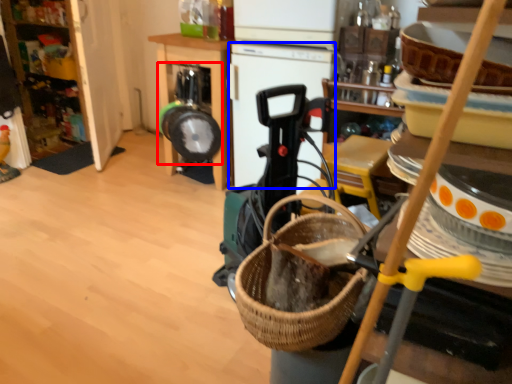
Question: Among these objects, which one is nearest to the camera, appliance (highlighted by a red box) or appliance (highlighted by a blue box)?

Choices:
 (A) appliance
 (B) appliance

Answer: (B)